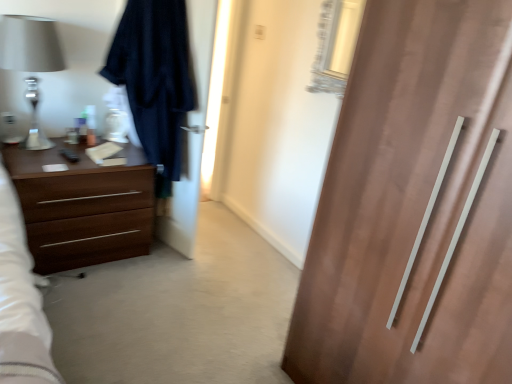
Question: Is brown wood chest of drawers at left taller or shorter than dark blue fabric robe at left?

Choices:
 (A) tall
 (B) short

Answer: (B)

Question: Is brown wood chest of drawers at left spatially inside dark blue fabric robe at left, or outside of it?

Choices:
 (A) inside
 (B) outside

Answer: (B)

Question: Which object is the farthest from the brown wood chest of drawers at left?

Choices:
 (A) matte silver lamp at left
 (B) dark fabric screen door at left
 (C) dark blue fabric robe at left

Answer: (A)

Question: Which of these objects is positioned closest to the dark blue fabric robe at left?

Choices:
 (A) matte silver lamp at left
 (B) dark fabric screen door at left
 (C) brown wood chest of drawers at left

Answer: (B)